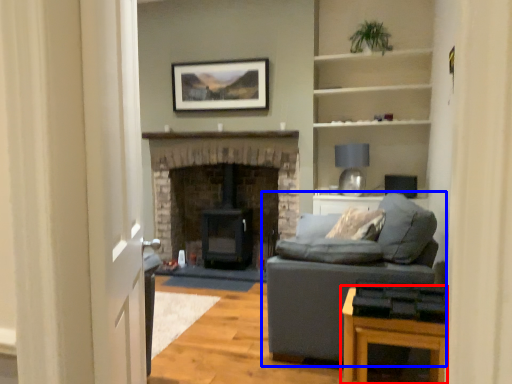
Question: Which object appears farthest to the camera in this image, table (highlighted by a red box) or studio couch (highlighted by a blue box)?

Choices:
 (A) table
 (B) studio couch

Answer: (B)